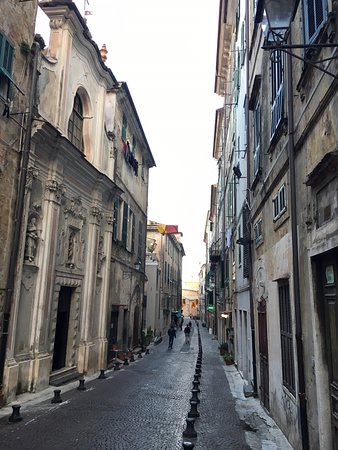
Find the location of a particular element. This screenshot has height=450, width=338. doorway is located at coordinates (68, 331).